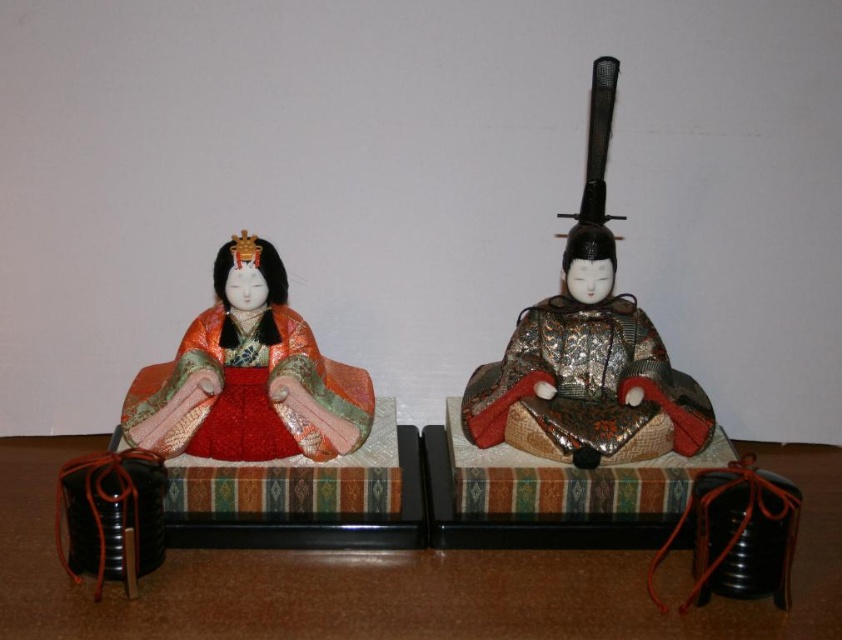
Question: Which of the following is the farthest from the observer?

Choices:
 (A) matte gold kimono at left
 (B) metallic gold armor at right

Answer: (A)

Question: Can you confirm if metallic gold armor at right is positioned above matte gold kimono at left?

Choices:
 (A) yes
 (B) no

Answer: (B)

Question: Which point is farther to the camera?

Choices:
 (A) metallic gold armor at right
 (B) matte gold kimono at left

Answer: (B)

Question: Among these points, which one is nearest to the camera?

Choices:
 (A) (641, 353)
 (B) (131, 397)

Answer: (B)

Question: Does metallic gold armor at right appear on the left side of matte gold kimono at left?

Choices:
 (A) yes
 (B) no

Answer: (B)

Question: Is metallic gold armor at right below matte gold kimono at left?

Choices:
 (A) yes
 (B) no

Answer: (A)